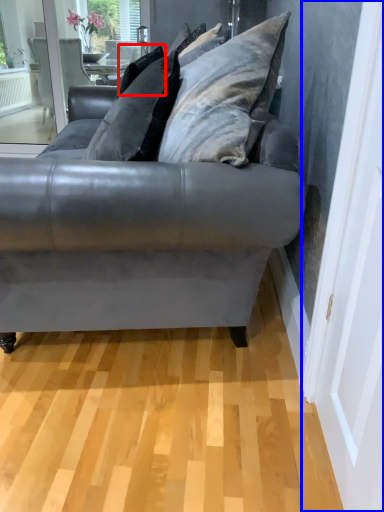
Question: Which point is closer to the camera, pillow (highlighted by a red box) or screen door (highlighted by a blue box)?

Choices:
 (A) pillow
 (B) screen door

Answer: (B)